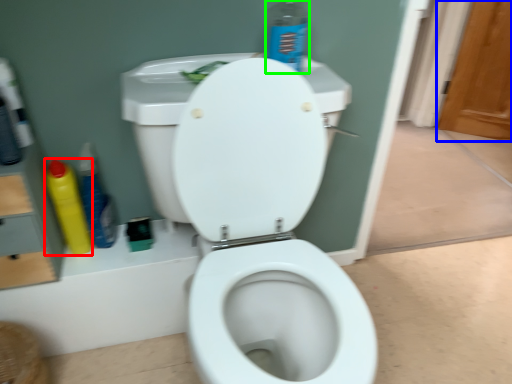
Question: Based on their relative distances, which object is nearer to cleaning product (highlighted by a red box)? Choose from screen door (highlighted by a blue box) and cleaning product (highlighted by a green box).

Choices:
 (A) screen door
 (B) cleaning product

Answer: (B)